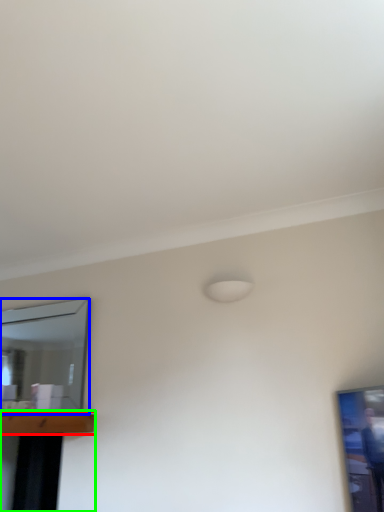
Question: Which object is positioned farthest from table (highlighted by a red box)? Select from mirror (highlighted by a blue box) and table (highlighted by a green box).

Choices:
 (A) mirror
 (B) table

Answer: (B)